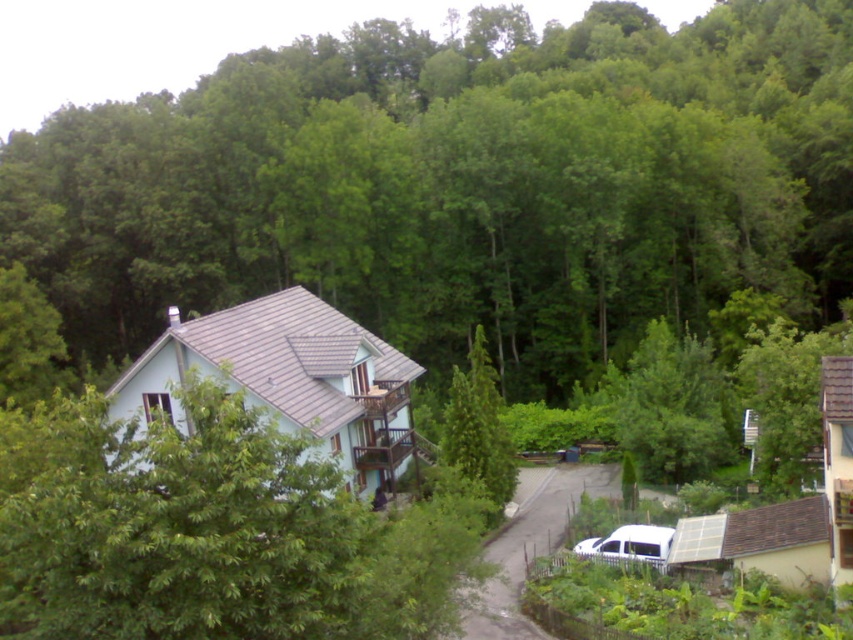
Between green textured tree at center and white matte van at lower right, which one appears on the right side from the viewer's perspective?

Positioned to the right is white matte van at lower right.

Measure the distance between point [463,380] and camera.

Point [463,380] is 43.56 meters away from camera.

Is point (482, 387) closer to camera compared to point (631, 552)?

No, (482, 387) is further to viewer.

Where is `green textured tree at center`? The height and width of the screenshot is (640, 853). green textured tree at center is located at coordinates coord(479,426).

Does green leafy tree at center appear over green textured tree at center?

Correct, green leafy tree at center is located above green textured tree at center.

Can you confirm if green leafy tree at center is positioned below green textured tree at center?

Incorrect, green leafy tree at center is not positioned below green textured tree at center.

Is point (601, 355) less distant than point (483, 416)?

No, (601, 355) is behind (483, 416).

Identify the location of green leafy tree at center. This screenshot has height=640, width=853. (461, 182).

Does green leafy tree at center have a lesser height compared to white matte van at lower right?

No.

In the scene shown: Who is more distant from viewer, (733, 150) or (637, 547)?

The point (733, 150) is more distant.

Locate an element on the screen. green leafy tree at center is located at coordinates (461, 182).